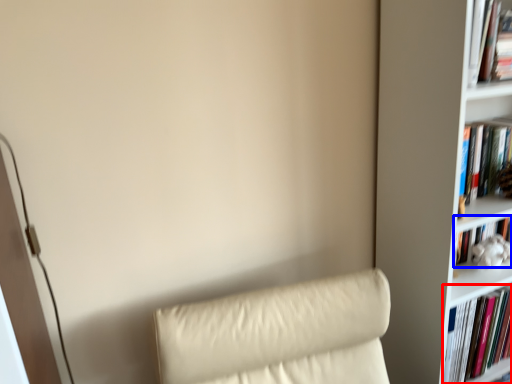
Question: Which object appears farthest to the camera in this image, book (highlighted by a red box) or book (highlighted by a blue box)?

Choices:
 (A) book
 (B) book

Answer: (B)